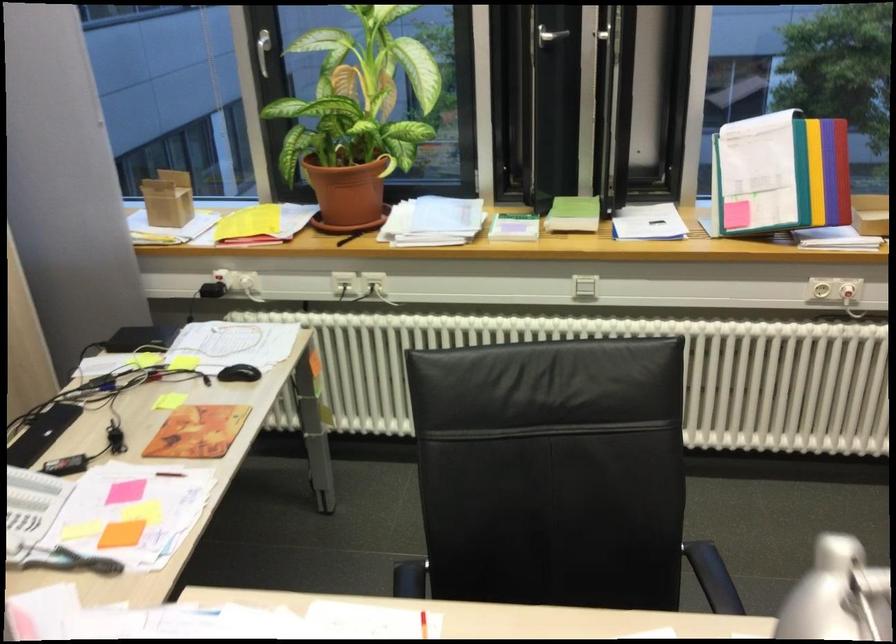
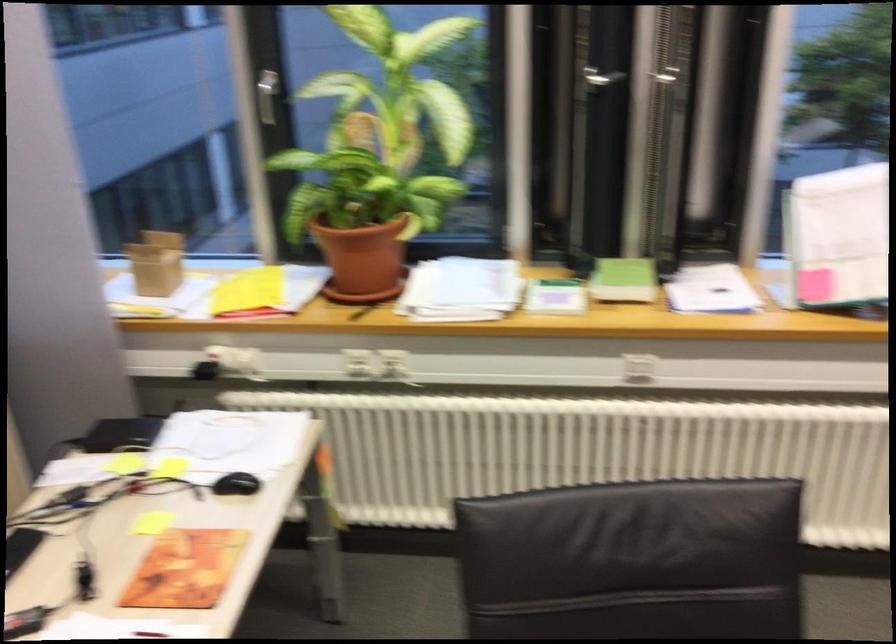
In the second image, find the point that corresponds to (192,431) in the first image.

(185, 569)